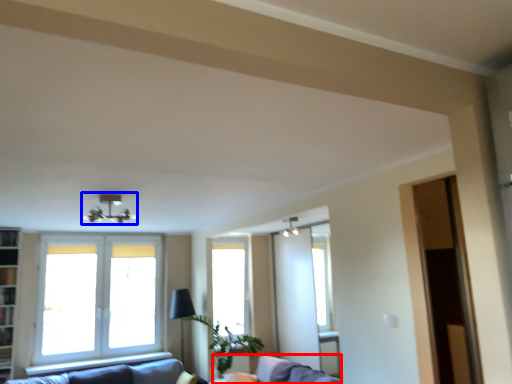
Question: Which object is closer to the camera taking this photo, swivel chair (highlighted by a red box) or light fixture (highlighted by a blue box)?

Choices:
 (A) swivel chair
 (B) light fixture

Answer: (B)